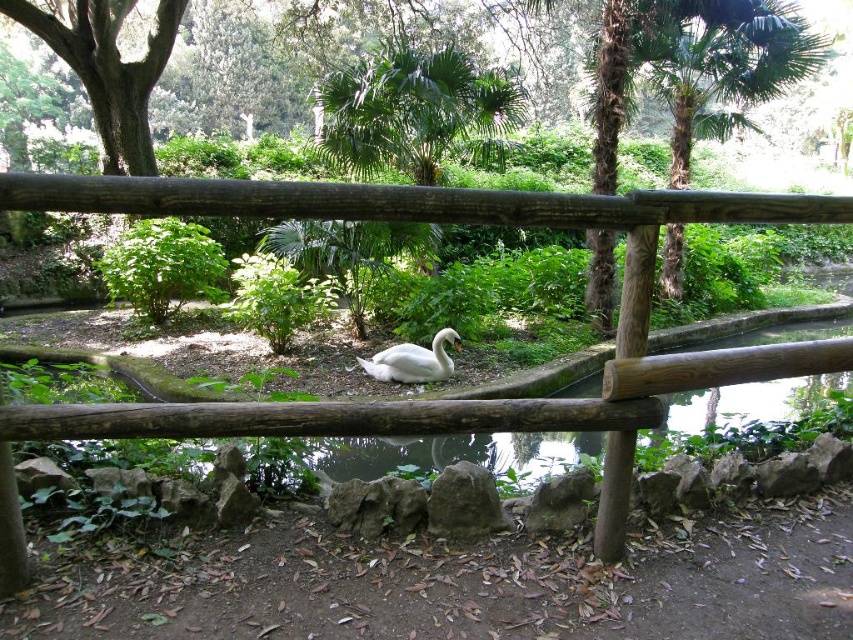
You are standing in the park and see two points marked in the scene. The first point is at coordinates point (38, 419) and the second is at point (387, 372). Which point is closer to you?

Point (38, 419) is in front of point (387, 372), so it is closer to you.

You are standing in the park and see the green leafy tree at center and the white glossy swan at center. Which one is nearer to you?

The green leafy tree at center is closer to the viewer than the white glossy swan at center.

You are standing in the park and see the wooden fence at center and the green leafy tree at center. Which one appears taller to you?

The green leafy tree at center is taller than the wooden fence at center.